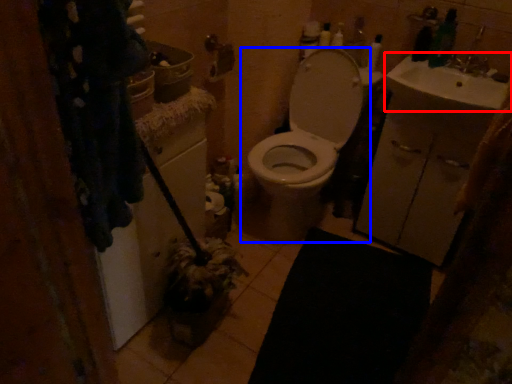
Question: Which point is closer to the camera, sink (highlighted by a red box) or toilet (highlighted by a blue box)?

Choices:
 (A) sink
 (B) toilet

Answer: (A)